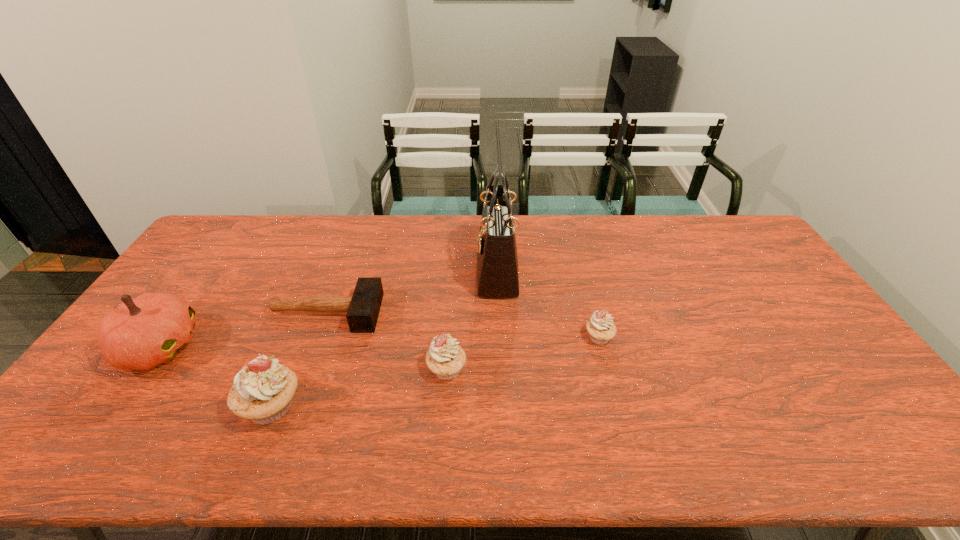
Observe the arrangement of all cupcakes in the image. To keep them evenly spaced, where would you place another cupcake on the right? Please locate a free space. Please provide its 2D coordinates. Your answer should be formatted as a tuple, i.e. [(x, y)], where the tuple contains the x and y coordinates of a point satisfying the conditions above.

[(732, 309)]